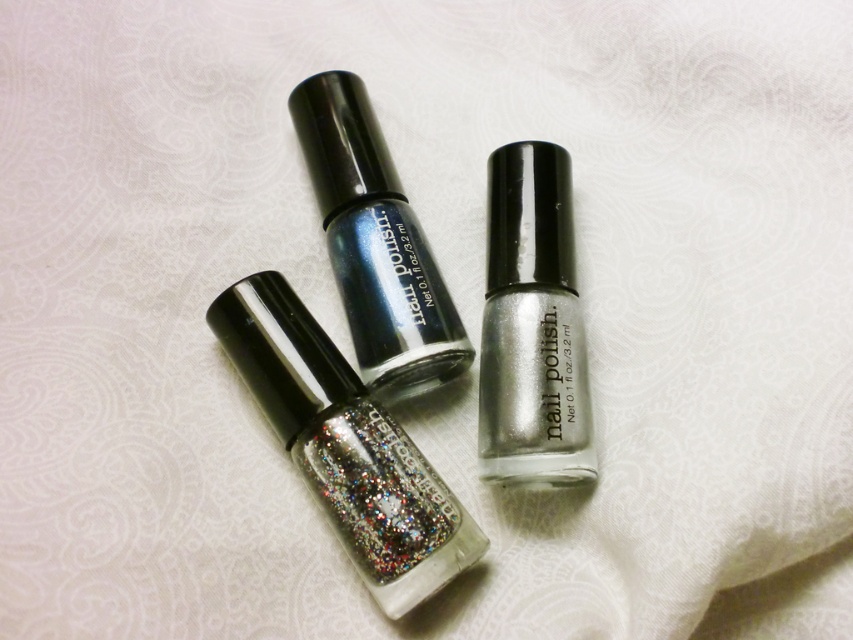
Which bottle has the point at coordinate (x=345, y=445)?

The point at coordinate (x=345, y=445) is on the glittery silver nail polish at center.

You are organizing nail polish bottles on a shelf. You have two bottles labeled as glittery silver nail polish at center and silver metallic nail polish at center. According to the image, which one is positioned lower?

The glittery silver nail polish at center is located below the silver metallic nail polish at center, so it is positioned lower.

You are holding a small plush toy that is 6 inches wide. You want to place it between the glittery silver nail polish at center and the dark teal nail polish on the right. Can the plush toy fit in the space between them?

The distance between the glittery silver nail polish at center and the dark teal nail polish on the right is not provided, so it is unknown if the plush toy can fit.